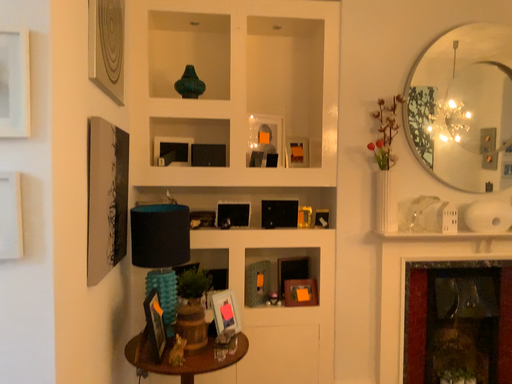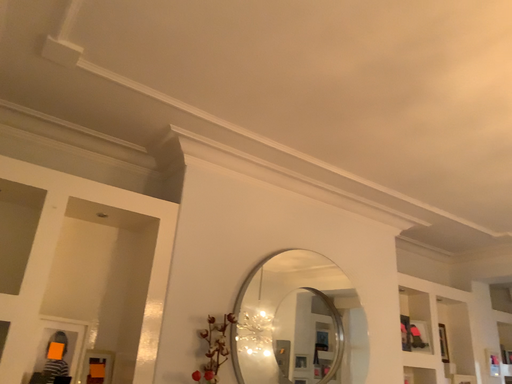
Question: Which way did the camera rotate in the video?

Choices:
 (A) rotated downward
 (B) rotated upward

Answer: (B)